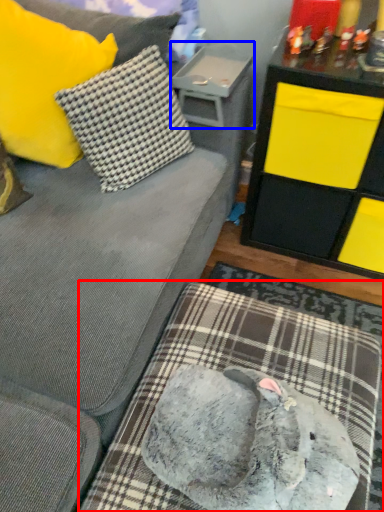
Question: Which object is closer to the camera taking this photo, dog bed (highlighted by a red box) or table (highlighted by a blue box)?

Choices:
 (A) dog bed
 (B) table

Answer: (A)